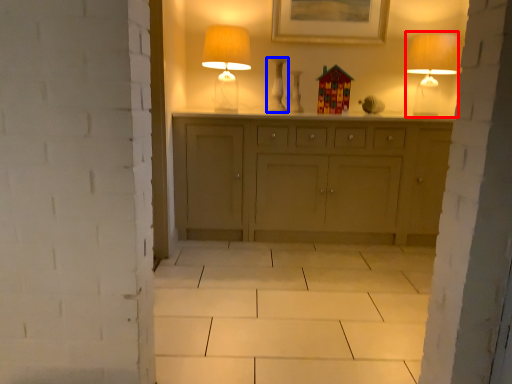
Question: Which object is closer to the camera taking this photo, table lamp (highlighted by a red box) or vase (highlighted by a blue box)?

Choices:
 (A) table lamp
 (B) vase

Answer: (A)